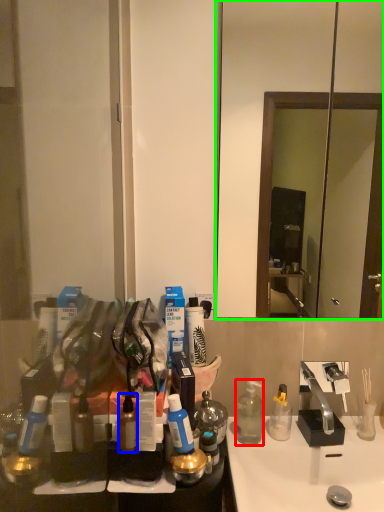
Question: Considering the real-world distances, which object is farthest from bottle (highlighted by a red box)? bottle (highlighted by a blue box) or mirror (highlighted by a green box)?

Choices:
 (A) bottle
 (B) mirror

Answer: (B)